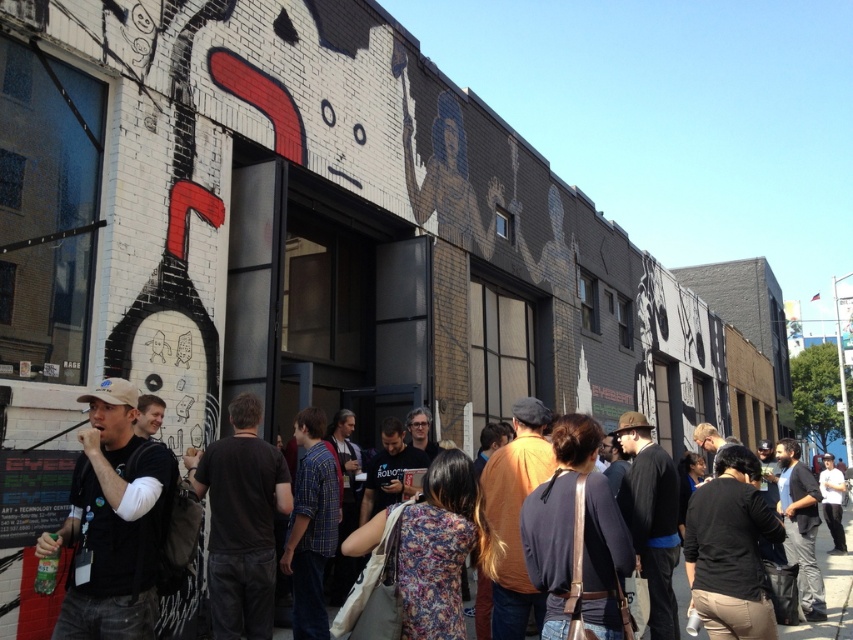
Between black matte t-shirt at lower left and dark clothing crowd at center, which one appears on the left side from the viewer's perspective?

Positioned to the left is black matte t-shirt at lower left.

Is black matte t-shirt at lower left below dark clothing crowd at center?

Incorrect, black matte t-shirt at lower left is not positioned below dark clothing crowd at center.

The image size is (853, 640). Describe the element at coordinates (113, 522) in the screenshot. I see `black matte t-shirt at lower left` at that location.

In order to click on black matte t-shirt at lower left in this screenshot , I will do `click(113, 522)`.